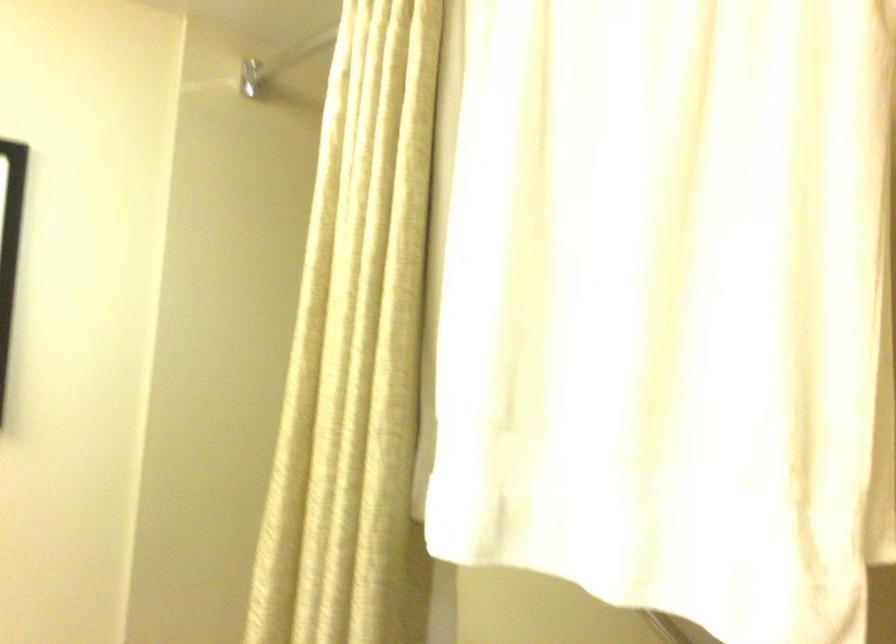
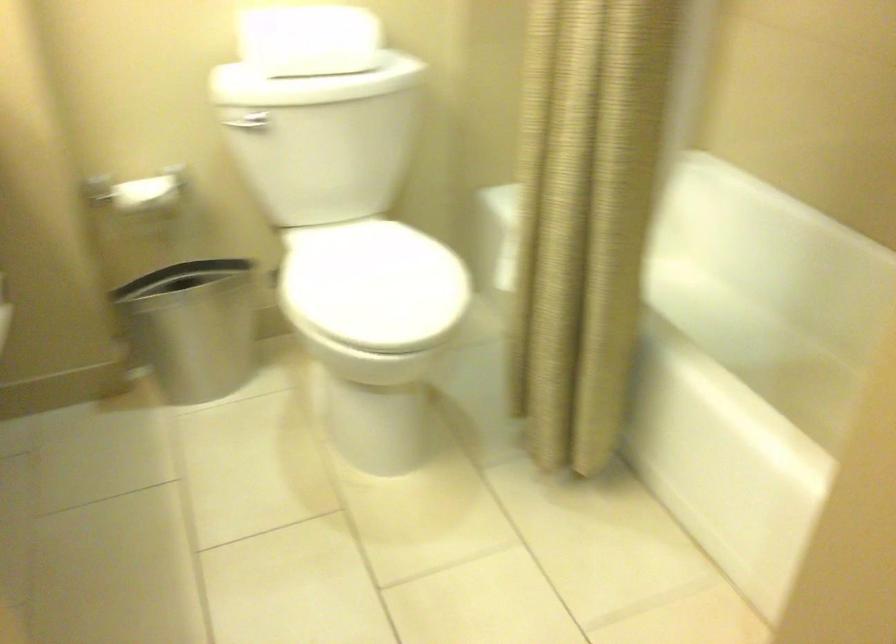
From the picture: The images are taken continuously from a first-person perspective. In which direction is your viewpoint rotating?

The rotation direction of the camera is left-down.